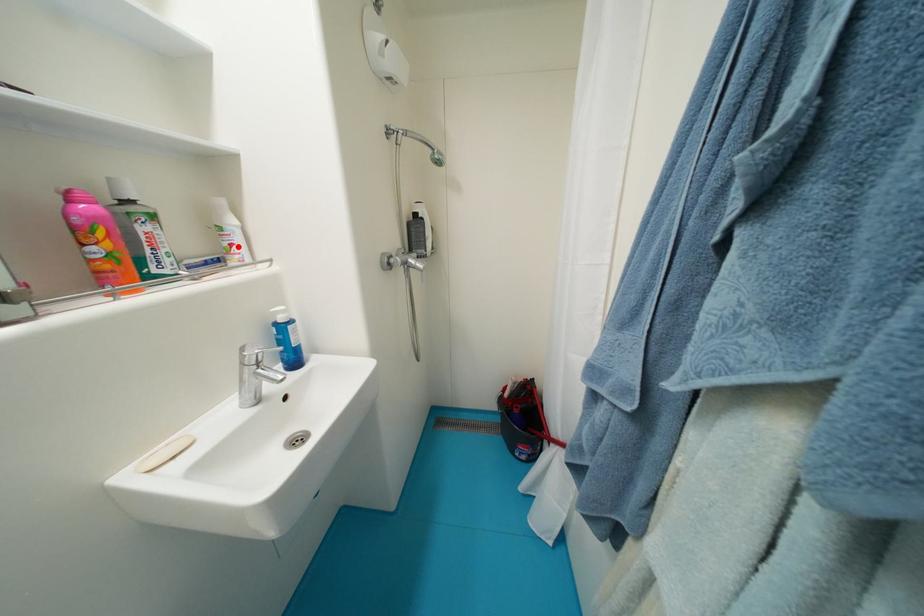
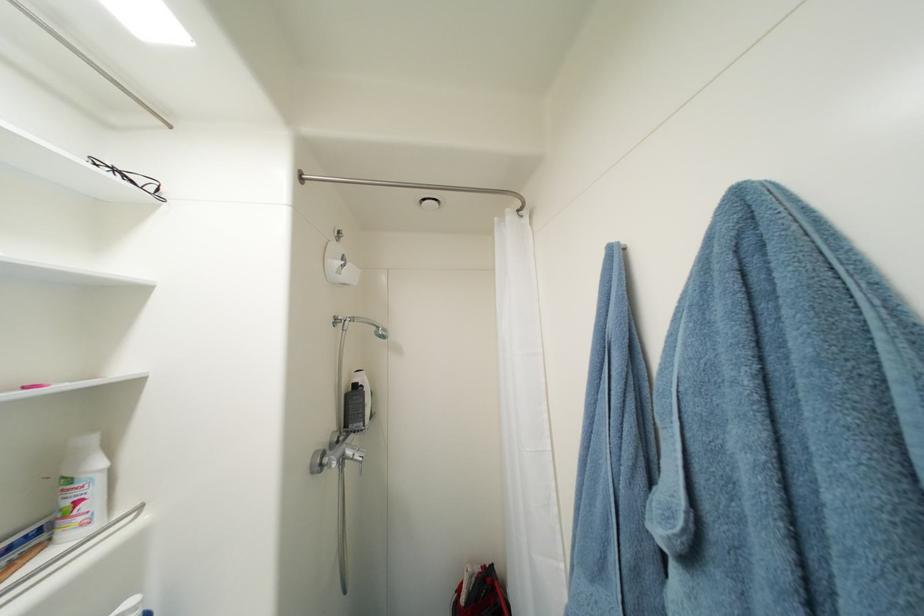
Find the pixel in the second image that matches the highlighted location in the first image.

(84, 504)